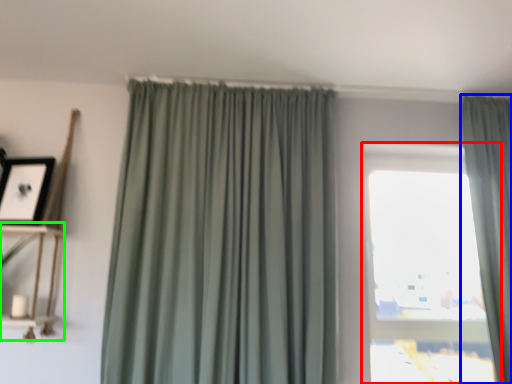
Question: Estimate the real-world distances between objects in this image. Which object is closer to window (highlighted by a red box), curtain (highlighted by a blue box) or shelf (highlighted by a green box)?

Choices:
 (A) curtain
 (B) shelf

Answer: (A)